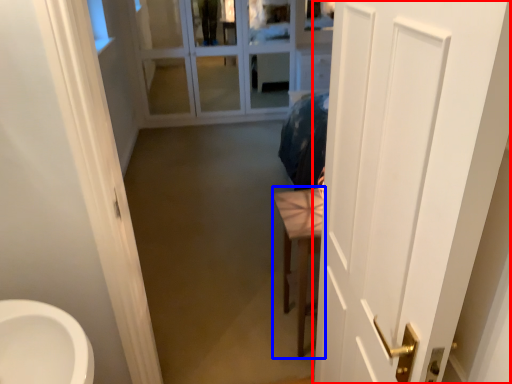
Question: Which object is further to the camera taking this photo, door (highlighted by a red box) or furniture (highlighted by a blue box)?

Choices:
 (A) door
 (B) furniture

Answer: (B)